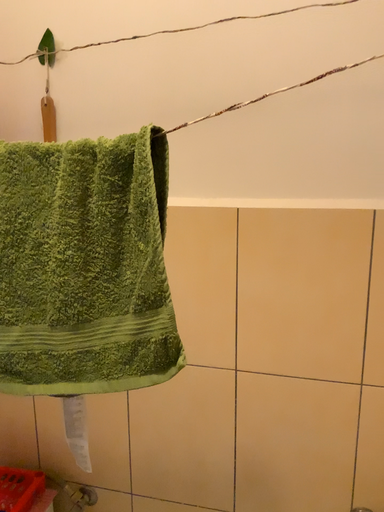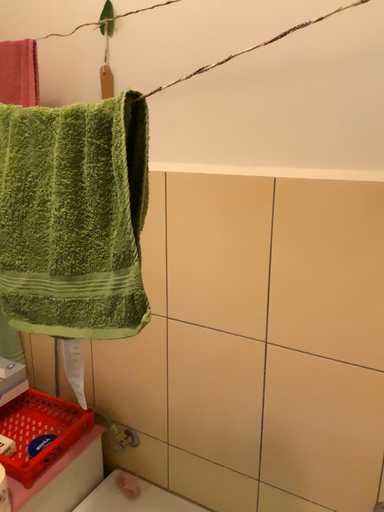
Question: Which way did the camera rotate in the video?

Choices:
 (A) rotated right
 (B) rotated left

Answer: (B)